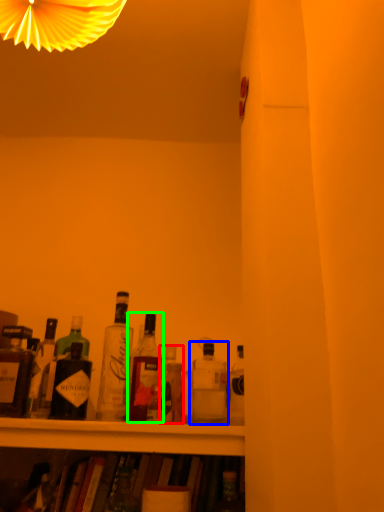
Question: Estimate the real-world distances between objects in this image. Which object is closer to bottle (highlighted by a red box), bottle (highlighted by a blue box) or bottle (highlighted by a green box)?

Choices:
 (A) bottle
 (B) bottle

Answer: (B)